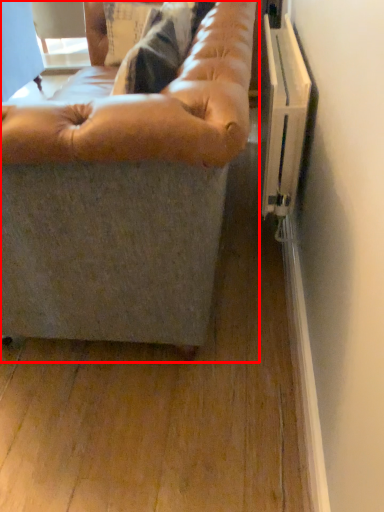
Question: From the image's perspective, what is the correct spatial positioning of studio couch (annotated by the red box) in reference to bean bag chair?

Choices:
 (A) below
 (B) above

Answer: (B)